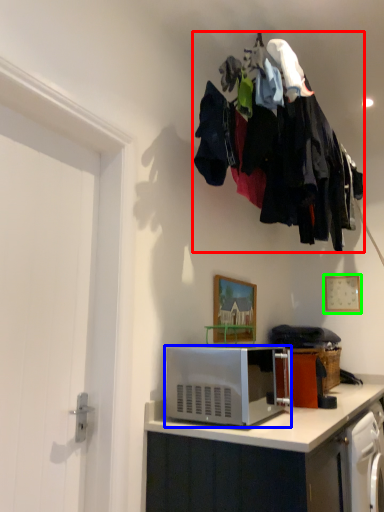
Question: Based on their relative distances, which object is farther from laundry (highlighted by a red box)? Choose from microwave oven (highlighted by a blue box) and picture frame (highlighted by a green box).

Choices:
 (A) microwave oven
 (B) picture frame

Answer: (B)